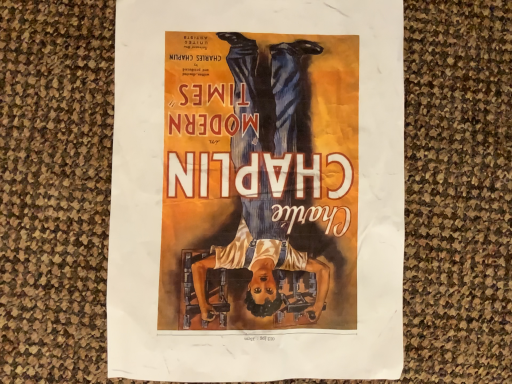
You are a GUI agent. You are given a task and a screenshot of the screen. Output one action in this format:
    pyautogui.click(x=<x>, y=<y>)
    Task: Click on the matte paper poster at center
    
    Given the screenshot: What is the action you would take?
    pyautogui.click(x=257, y=190)

What do you see at coordinates (257, 190) in the screenshot? I see `matte paper poster at center` at bounding box center [257, 190].

Find the location of a particular element. matte paper poster at center is located at coordinates (257, 190).